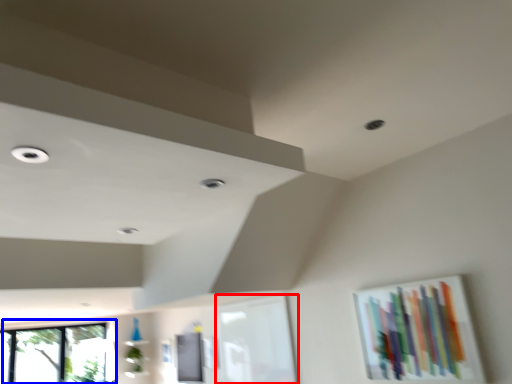
Question: Which object appears farthest to the camera in this image, window frame (highlighted by a red box) or window (highlighted by a blue box)?

Choices:
 (A) window frame
 (B) window

Answer: (B)